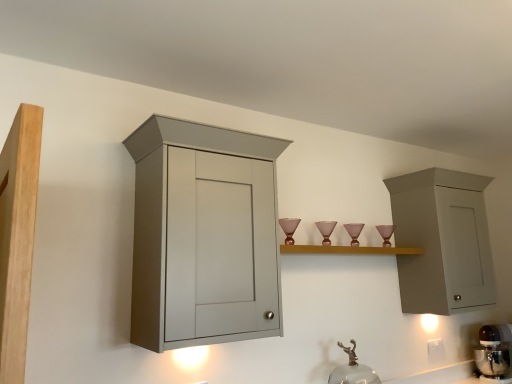
At what (x,y) coordinates should I click in order to perform the action: click on white plastic electric outlet at lower right. Please return your answer as a coordinate pair (x, y). Looking at the image, I should click on (435, 346).

What do you see at coordinates (435, 346) in the screenshot? The width and height of the screenshot is (512, 384). I see `white plastic electric outlet at lower right` at bounding box center [435, 346].

What are the coordinates of `transparent glass faucet at lower center` in the screenshot? It's located at (353, 370).

Find the location of `metallic silver mixer at lower right`. metallic silver mixer at lower right is located at coordinates (494, 351).

Measure the distance between matte wood cupboard at left and camera.

matte wood cupboard at left and camera are 30.35 inches apart from each other.

Identify the location of matte gray cabinet at left, the second cabinetry from the right. This screenshot has width=512, height=384. (204, 235).

Visually, is matte gray cabinet at upper right, which is the 2th cabinetry from left to right, positioned to the left or to the right of matte gray cabinet at left, acting as the second cabinetry starting from the back?

Clearly, matte gray cabinet at upper right, which is the 2th cabinetry from left to right, is on the right of matte gray cabinet at left, acting as the second cabinetry starting from the back, in the image.

Does matte gray cabinet at upper right, which is the 2th cabinetry from left to right, lie behind matte gray cabinet at left, acting as the second cabinetry starting from the back?

Yes, it is behind matte gray cabinet at left, acting as the second cabinetry starting from the back.

At what (x,y) coordinates should I click in order to perform the action: click on cabinetry above the matte gray cabinet at upper right, which appears as the 1th cabinetry when viewed from the right (from the image's perspective). Please return your answer as a coordinate pair (x, y). Looking at the image, I should click on (204, 235).

Can you confirm if light wood shelf at center is thinner than transparent glass faucet at lower center?

Indeed, light wood shelf at center has a lesser width compared to transparent glass faucet at lower center.

This screenshot has height=384, width=512. In order to click on shelf above the transparent glass faucet at lower center (from the image's perspective) in this screenshot , I will do `click(349, 250)`.

Could you tell me if light wood shelf at center is facing transparent glass faucet at lower center?

No, light wood shelf at center is not turned towards transparent glass faucet at lower center.

From the image's perspective, who appears lower, matte gray cabinet at upper right, which appears as the 1th cabinetry when viewed from the right, or metallic silver mixer at lower right?

metallic silver mixer at lower right, from the image's perspective.

Looking at their sizes, would you say matte gray cabinet at upper right, the 2th cabinetry from the front, is wider or thinner than metallic silver mixer at lower right?

Clearly, matte gray cabinet at upper right, the 2th cabinetry from the front, has more width compared to metallic silver mixer at lower right.

From a real-world perspective, is matte gray cabinet at upper right, marked as the 1th cabinetry in a back-to-front arrangement, under metallic silver mixer at lower right?

Actually, matte gray cabinet at upper right, marked as the 1th cabinetry in a back-to-front arrangement, is physically above metallic silver mixer at lower right in the real world.

Can you tell me how much matte gray cabinet at upper right, which is the 2th cabinetry from left to right, and metallic silver mixer at lower right differ in facing direction?

21 degrees separate the facing orientations of matte gray cabinet at upper right, which is the 2th cabinetry from left to right, and metallic silver mixer at lower right.

Considering the positions of points (373, 378) and (488, 348), is point (373, 378) closer to camera compared to point (488, 348)?

Yes, point (373, 378) is in front of point (488, 348).

Considering the positions of objects transparent glass faucet at lower center and metallic silver mixer at lower right in the image provided, who is more to the left, transparent glass faucet at lower center or metallic silver mixer at lower right?

From the viewer's perspective, transparent glass faucet at lower center appears more on the left side.

From the picture: From a real-world perspective, is transparent glass faucet at lower center above or below metallic silver mixer at lower right?

transparent glass faucet at lower center is above metallic silver mixer at lower right.

How far apart are transparent glass faucet at lower center and metallic silver mixer at lower right?

transparent glass faucet at lower center and metallic silver mixer at lower right are 38.90 inches apart from each other.

What are the coordinates of `appliance located on the right of matte gray cabinet at left, which appears as the first cabinetry when viewed from the left` in the screenshot? It's located at (494, 351).

Is matte gray cabinet at left, which appears as the first cabinetry when viewed from the left, taller or shorter than metallic silver mixer at lower right?

In the image, matte gray cabinet at left, which appears as the first cabinetry when viewed from the left, appears to be taller than metallic silver mixer at lower right.

Is metallic silver mixer at lower right a part of matte gray cabinet at left, the second cabinetry from the right?

That's incorrect, metallic silver mixer at lower right is not inside matte gray cabinet at left, the second cabinetry from the right.

Which object is closer to the camera taking this photo, matte gray cabinet at left, which appears as the first cabinetry when viewed from the left, or metallic silver mixer at lower right?

matte gray cabinet at left, which appears as the first cabinetry when viewed from the left, is in front.

Considering the relative sizes of transparent glass faucet at lower center and matte gray cabinet at upper right, the 2th cabinetry from the front, in the image provided, is transparent glass faucet at lower center taller than matte gray cabinet at upper right, the 2th cabinetry from the front,?

No.

From a real-world perspective, who is located lower, transparent glass faucet at lower center or matte gray cabinet at upper right, which appears as the 1th cabinetry when viewed from the right?

In real-world perspective, transparent glass faucet at lower center is lower.

The width and height of the screenshot is (512, 384). What are the coordinates of `faucet on the left of matte gray cabinet at upper right, the 2th cabinetry from the front` in the screenshot? It's located at (353, 370).

Consider the image. Is matte gray cabinet at upper right, marked as the 1th cabinetry in a back-to-front arrangement, inside transparent glass faucet at lower center?

No.

Based on the photo, considering the relative sizes of metallic silver mixer at lower right and matte gray cabinet at upper right, which appears as the 1th cabinetry when viewed from the right, in the image provided, is metallic silver mixer at lower right bigger than matte gray cabinet at upper right, which appears as the 1th cabinetry when viewed from the right,?

No.

Are metallic silver mixer at lower right and matte gray cabinet at upper right, marked as the 1th cabinetry in a back-to-front arrangement, located far from each other?

No, metallic silver mixer at lower right is in close proximity to matte gray cabinet at upper right, marked as the 1th cabinetry in a back-to-front arrangement.

Which is correct: metallic silver mixer at lower right is inside matte gray cabinet at upper right, which appears as the 1th cabinetry when viewed from the right, or outside of it?

metallic silver mixer at lower right exists outside the volume of matte gray cabinet at upper right, which appears as the 1th cabinetry when viewed from the right.

From a real-world perspective, is metallic silver mixer at lower right over matte gray cabinet at upper right, which appears as the 1th cabinetry when viewed from the right?

Incorrect, from a real-world perspective, metallic silver mixer at lower right is lower than matte gray cabinet at upper right, which appears as the 1th cabinetry when viewed from the right.

At what (x,y) coordinates should I click in order to perform the action: click on cabinetry located behind the matte gray cabinet at left, which appears as the first cabinetry when viewed from the left. Please return your answer as a coordinate pair (x, y). Looking at the image, I should click on (442, 241).

Locate an element on the screen. faucet in front of the light wood shelf at center is located at coordinates (353, 370).

Which object lies nearer to the anchor point matte wood cupboard at left, matte gray cabinet at upper right, marked as the 1th cabinetry in a back-to-front arrangement, or transparent glass faucet at lower center?

Among the two, transparent glass faucet at lower center is located nearer to matte wood cupboard at left.

Estimate the real-world distances between objects in this image. Which object is further from transparent glass faucet at lower center, matte gray cabinet at left, which appears as the first cabinetry when viewed from the left, or matte gray cabinet at upper right, which appears as the 1th cabinetry when viewed from the right?

matte gray cabinet at left, which appears as the first cabinetry when viewed from the left, is further to transparent glass faucet at lower center.

From the image, which object appears to be nearer to matte gray cabinet at upper right, which appears as the 1th cabinetry when viewed from the right, white plastic electric outlet at lower right or matte gray cabinet at left, acting as the second cabinetry starting from the back?

Among the two, white plastic electric outlet at lower right is located nearer to matte gray cabinet at upper right, which appears as the 1th cabinetry when viewed from the right.

Which object lies nearer to the anchor point metallic silver mixer at lower right, matte wood cupboard at left or transparent glass faucet at lower center?

transparent glass faucet at lower center lies closer to metallic silver mixer at lower right than the other object.

Which object lies further to the anchor point transparent glass faucet at lower center, white plastic electric outlet at lower right or matte wood cupboard at left?

The object further to transparent glass faucet at lower center is matte wood cupboard at left.

Considering their positions, is metallic silver mixer at lower right positioned further to matte gray cabinet at upper right, the 2th cabinetry from the front, than matte gray cabinet at left, acting as the second cabinetry starting from the back?

matte gray cabinet at left, acting as the second cabinetry starting from the back, lies further to matte gray cabinet at upper right, the 2th cabinetry from the front, than the other object.

When comparing their distances from metallic silver mixer at lower right, does light wood shelf at center or transparent glass faucet at lower center seem closer?

The object closer to metallic silver mixer at lower right is light wood shelf at center.

Estimate the real-world distances between objects in this image. Which object is closer to metallic silver mixer at lower right, matte gray cabinet at upper right, the 2th cabinetry from the front, or light wood shelf at center?

Based on the image, matte gray cabinet at upper right, the 2th cabinetry from the front, appears to be nearer to metallic silver mixer at lower right.

Find the location of a particular element. faucet located between matte wood cupboard at left and white plastic electric outlet at lower right in the depth direction is located at coordinates (353, 370).

Locate an element on the screen. shelf between matte gray cabinet at left, the second cabinetry from the right, and white plastic electric outlet at lower right from left to right is located at coordinates (349, 250).

Find the location of a particular element. This screenshot has width=512, height=384. electric outlet situated between matte wood cupboard at left and matte gray cabinet at upper right, the 2th cabinetry from the front, from left to right is located at coordinates (435, 346).

Find the location of a particular element. This screenshot has height=384, width=512. shelf located between matte wood cupboard at left and matte gray cabinet at upper right, marked as the 1th cabinetry in a back-to-front arrangement, in the left-right direction is located at coordinates (349, 250).